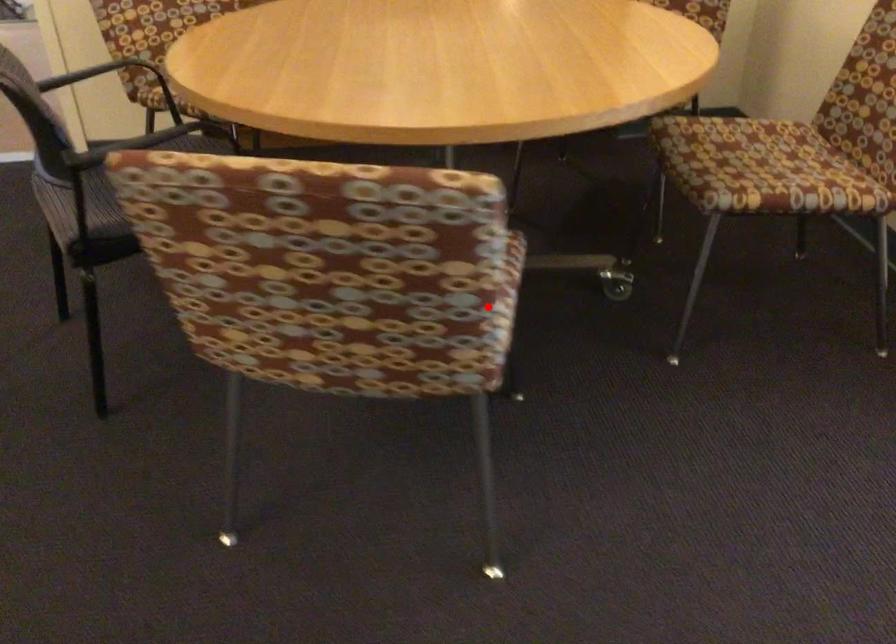
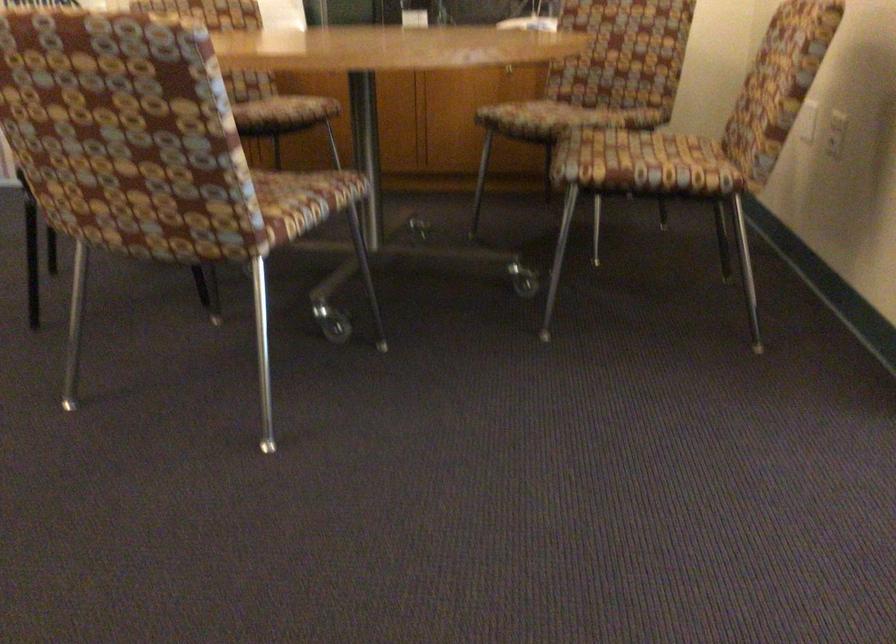
Locate, in the second image, the point that corresponds to the highlighted location in the first image.

(289, 204)